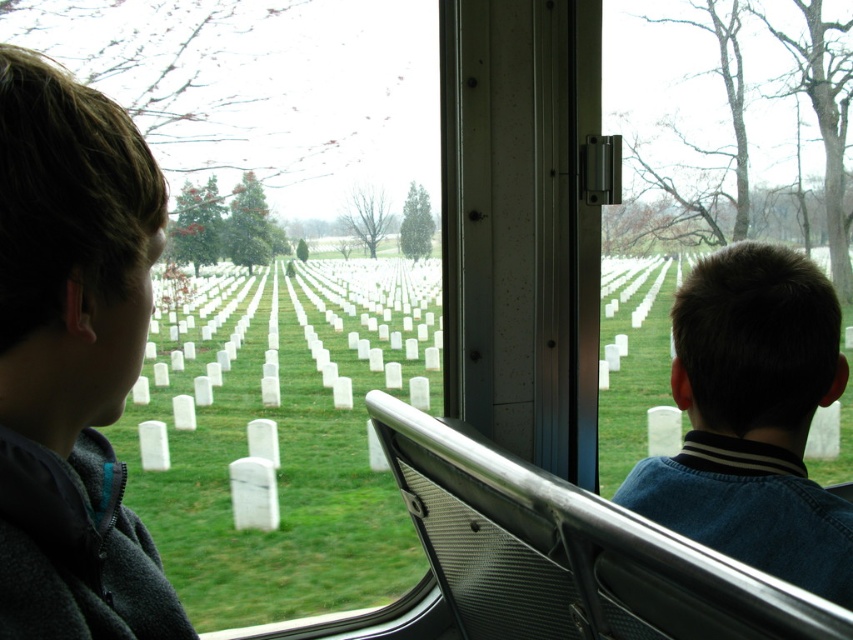
Between point (91, 148) and point (712, 292), which one is positioned behind?

Point (712, 292)

Which is behind, point (115, 374) or point (721, 525)?

Point (721, 525)

Find the location of `dark brown hair at left`. dark brown hair at left is located at coordinates (73, 358).

Is dark brown hair at left further to the viewer compared to clear glass window at center?

No.

Does dark brown hair at left have a lesser width compared to clear glass window at center?

Correct, dark brown hair at left's width is less than clear glass window at center's.

Where is `dark brown hair at left`? The image size is (853, 640). dark brown hair at left is located at coordinates (73, 358).

You are a GUI agent. You are given a task and a screenshot of the screen. Output one action in this format:
    pyautogui.click(x=<x>, y=<y>)
    Task: Click on the dark blue sweater at center
    The width and height of the screenshot is (853, 640).
    Given the screenshot: What is the action you would take?
    pyautogui.click(x=753, y=419)

Is point (682, 392) behind point (831, 397)?

Yes.

Who is more forward, [728,298] or [674,364]?

Positioned in front is point [728,298].

Find the location of a particular element. The width and height of the screenshot is (853, 640). dark blue sweater at center is located at coordinates (753, 419).